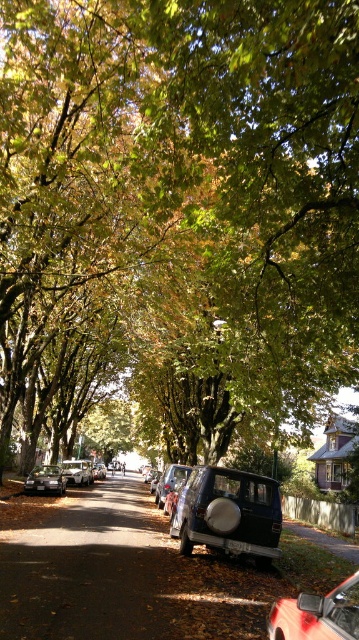
Question: Among these objects, which one is nearest to the camera?

Choices:
 (A) metallic red car at center
 (B) matte black car at center
 (C) shiny silver sedan at lower left

Answer: (A)

Question: Does metallic silver suv at center appear over matte black car at center?

Choices:
 (A) no
 (B) yes

Answer: (B)

Question: Is metallic red car at center thinner than metallic silver suv at center?

Choices:
 (A) no
 (B) yes

Answer: (B)

Question: Does metallic red car at center have a smaller size compared to shiny silver sedan at lower left?

Choices:
 (A) yes
 (B) no

Answer: (A)

Question: Which object is positioned closest to the matte black car at center?

Choices:
 (A) shiny silver sedan at lower left
 (B) metallic red car at center
 (C) metallic silver suv at center
 (D) matte black suv at center

Answer: (C)

Question: Which point is closer to the camera?

Choices:
 (A) (164, 476)
 (B) (334, 604)

Answer: (B)